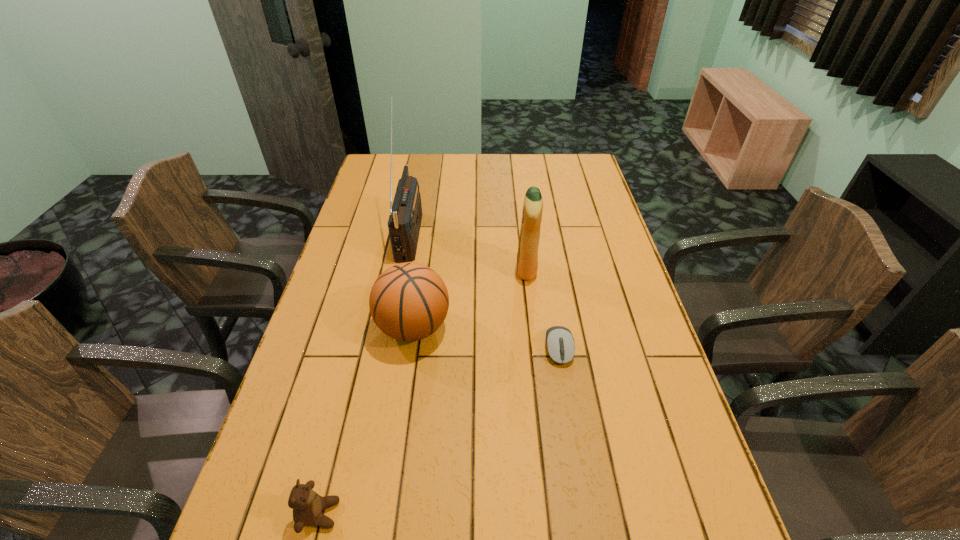
The height and width of the screenshot is (540, 960). In order to click on the tallest object in this screenshot , I will do `click(404, 222)`.

The width and height of the screenshot is (960, 540). Identify the location of detergent. (527, 256).

The height and width of the screenshot is (540, 960). Identify the location of basketball. (409, 301).

The image size is (960, 540). Find the location of `computer equipment`. computer equipment is located at coordinates (560, 343).

Locate an element on the screen. The image size is (960, 540). vacant space located on the front-facing side of the tallest object is located at coordinates (493, 233).

At what (x,y) coordinates should I click in order to perform the action: click on vacant space situated 0.070m on the label of the detergent. Please return your answer as a coordinate pair (x, y). This screenshot has height=540, width=960. Looking at the image, I should click on (493, 269).

I want to click on vacant space located 0.270m on the label of the detergent, so click(x=430, y=269).

Where is `vacant space positioned 0.250m on the label of the detergent`? This screenshot has height=540, width=960. vacant space positioned 0.250m on the label of the detergent is located at coordinates (436, 269).

Image resolution: width=960 pixels, height=540 pixels. In order to click on free space located 0.390m on the back of the basketball in this screenshot , I will do `click(428, 221)`.

What are the coordinates of `vacant space situated on the wheel side of the shortest object` in the screenshot? It's located at (588, 529).